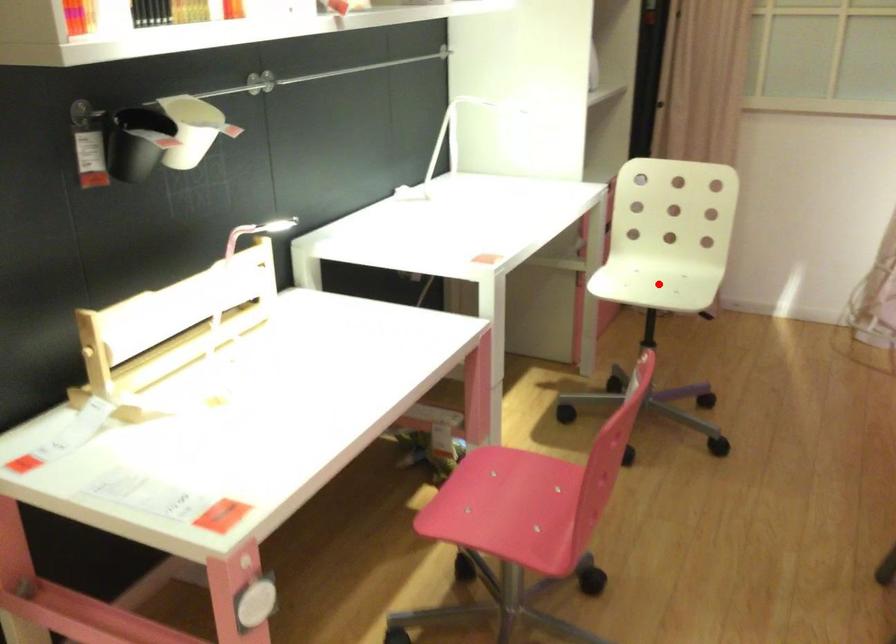
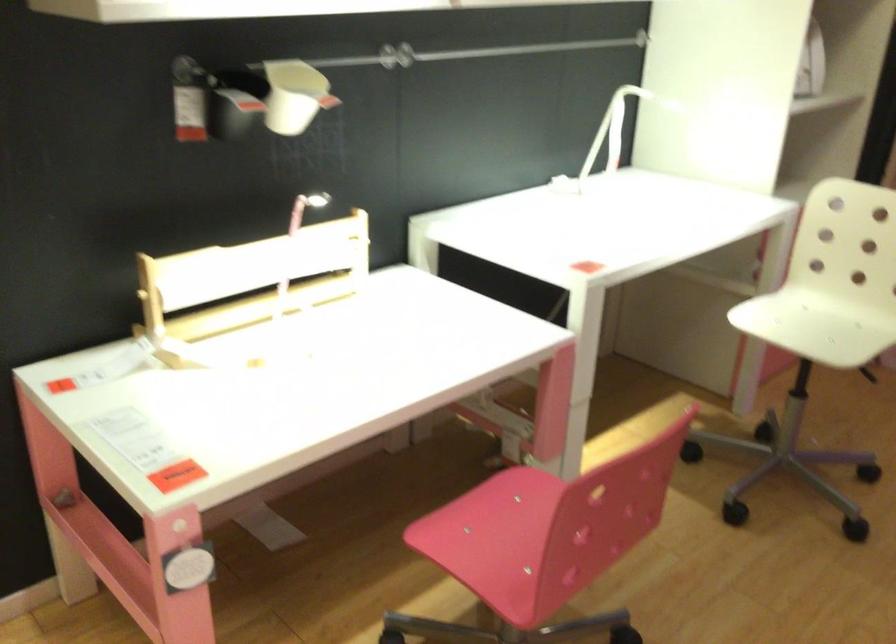
In the second image, find the point that corresponds to the highlighted location in the first image.

(812, 327)